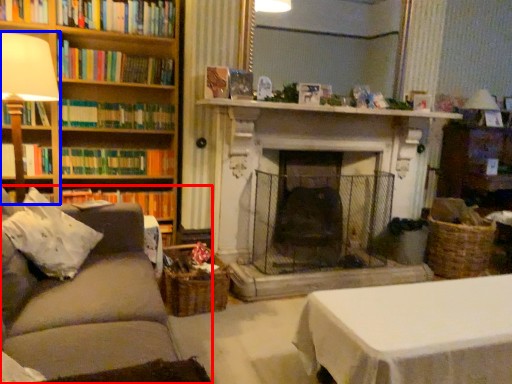
Question: Which object is closer to the camera taking this photo, studio couch (highlighted by a red box) or table lamp (highlighted by a blue box)?

Choices:
 (A) studio couch
 (B) table lamp

Answer: (A)